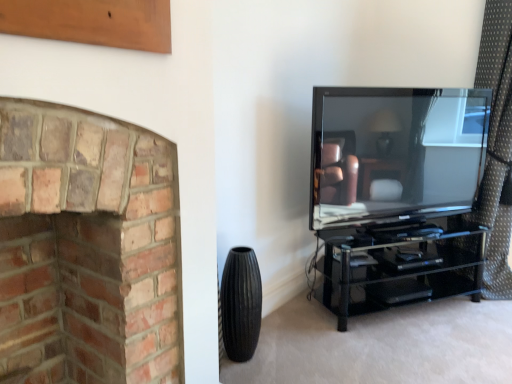
Question: From a real-world perspective, is matte black tv at right physically located above or below brown dotted fabric at right?

Choices:
 (A) below
 (B) above

Answer: (A)

Question: Considering their positions, is matte black tv at right located in front of or behind brown dotted fabric at right?

Choices:
 (A) behind
 (B) front

Answer: (B)

Question: Based on their relative distances, which object is farther from the brown dotted fabric at right?

Choices:
 (A) matte black tv at right
 (B) red brick fireplace at left
 (C) black ribbed vase at lower center

Answer: (B)

Question: Considering the real-world distances, which object is farthest from the matte black tv at right?

Choices:
 (A) brown dotted fabric at right
 (B) black ribbed vase at lower center
 (C) red brick fireplace at left

Answer: (C)